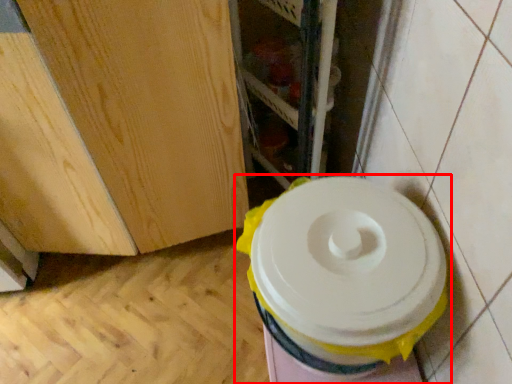
Question: From the image's perspective, where is toilet (annotated by the red box) located in relation to shelf in the image?

Choices:
 (A) below
 (B) above

Answer: (A)